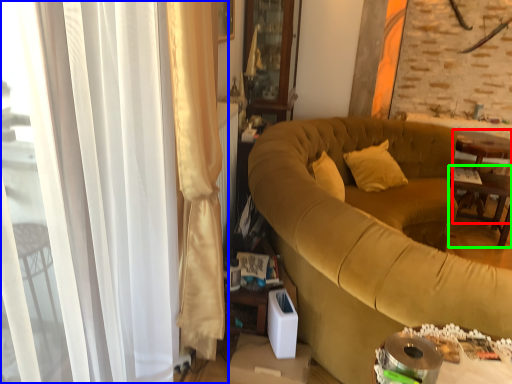
Question: Which is nearer to the table (highlighted by a red box)? curtain (highlighted by a blue box) or table (highlighted by a green box).

Choices:
 (A) curtain
 (B) table

Answer: (B)